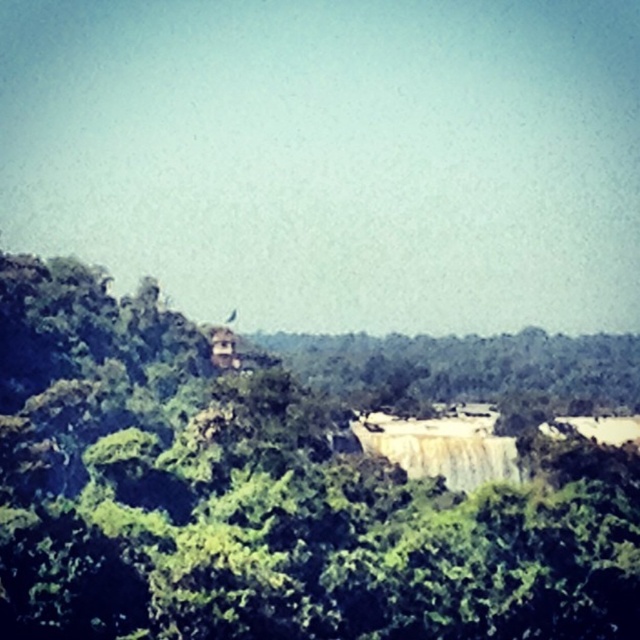
Question: Which point is farther to the camera?

Choices:
 (A) white smooth waterfall at center
 (B) green leafy tree at center

Answer: (A)

Question: Can you confirm if green leafy tree at center is positioned to the left of white smooth waterfall at center?

Choices:
 (A) no
 (B) yes

Answer: (B)

Question: Does green leafy tree at center appear over white smooth waterfall at center?

Choices:
 (A) yes
 (B) no

Answer: (A)

Question: Which of the following is the closest to the observer?

Choices:
 (A) 388,458
 (B) 291,452

Answer: (B)

Question: Is green leafy tree at center smaller than white smooth waterfall at center?

Choices:
 (A) no
 (B) yes

Answer: (A)